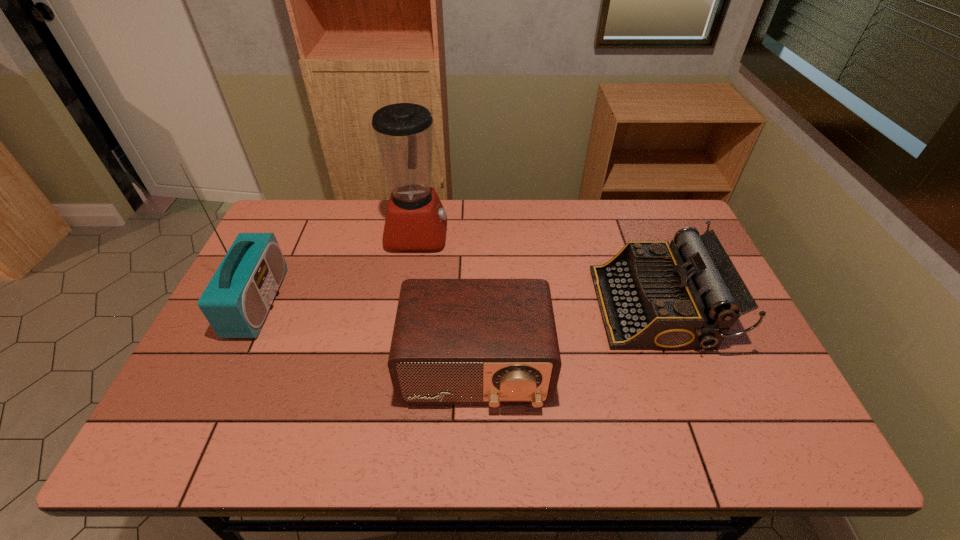
You are a GUI agent. You are given a task and a screenshot of the screen. Output one action in this format:
    pyautogui.click(x=<x>, y=<y>)
    Task: Click on the vacant region located 0.380m on the keyboard of the typewriter
    This screenshot has height=540, width=960.
    Given the screenshot: What is the action you would take?
    pyautogui.click(x=464, y=307)

Identify the location of object positioned at the far edge. The width and height of the screenshot is (960, 540). (416, 220).

Identify the location of object situated at the left edge. The height and width of the screenshot is (540, 960). (236, 301).

Locate an element on the screen. object situated at the right edge is located at coordinates (653, 295).

Find the location of a particular element. The width and height of the screenshot is (960, 540). blank area at the far edge is located at coordinates [x=331, y=215].

You are a GUI agent. You are given a task and a screenshot of the screen. Output one action in this format:
    pyautogui.click(x=<x>, y=<y>)
    Task: Click on the vacant space at the near edge
    This screenshot has height=540, width=960.
    Given the screenshot: What is the action you would take?
    pyautogui.click(x=618, y=443)

This screenshot has height=540, width=960. Identify the location of vacant space at the left edge of the desktop. (231, 390).

Locate an element on the screen. This screenshot has height=540, width=960. vacant region at the right edge of the desktop is located at coordinates (727, 339).

You are a GUI agent. You are given a task and a screenshot of the screen. Output one action in this format:
    pyautogui.click(x=<x>, y=<y>)
    Task: Click on the vacant region at the far right corner of the desktop
    The width and height of the screenshot is (960, 540).
    Given the screenshot: What is the action you would take?
    pyautogui.click(x=673, y=222)

The image size is (960, 540). In order to click on vacant area that lies between the rightmost object and the shorter radio receiver in this screenshot , I will do coord(565,338).